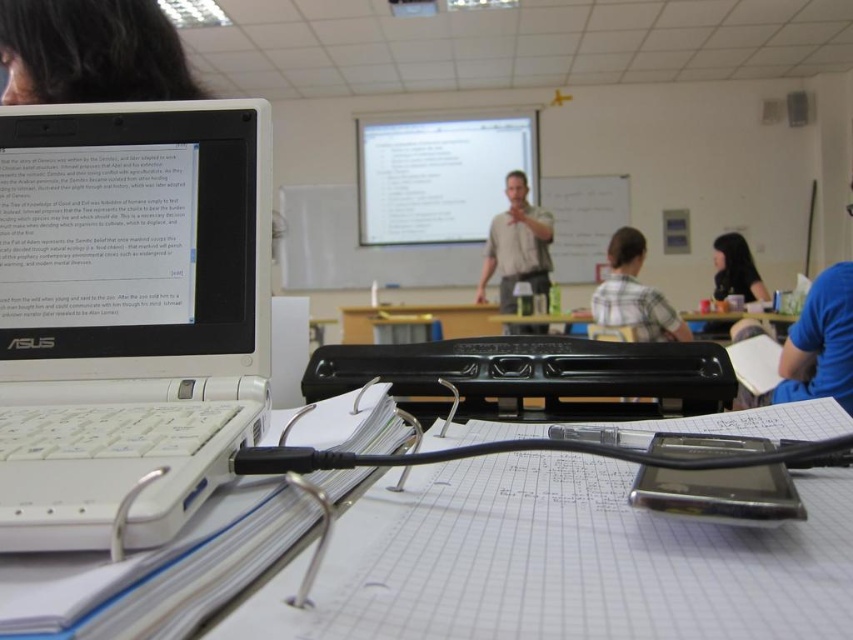
Question: Among these objects, which one is nearest to the camera?

Choices:
 (A) black hair at upper left
 (B) white plastic table at center
 (C) whiteboard at center
 (D) black hair at upper right

Answer: (B)

Question: Which point appears closest to the camera in this image?

Choices:
 (A) (585, 221)
 (B) (630, 289)
 (C) (201, 298)

Answer: (C)

Question: Can you confirm if light beige shirt at center is positioned to the right of plaid shirt at center?

Choices:
 (A) no
 (B) yes

Answer: (A)

Question: Considering the real-world distances, which object is closest to the blue fabric shirt at right?

Choices:
 (A) white plastic table at center
 (B) black hair at upper right
 (C) plaid shirt at center

Answer: (C)

Question: Is whiteboard at center smaller than plaid shirt at center?

Choices:
 (A) no
 (B) yes

Answer: (B)

Question: Does white plastic table at center have a lesser width compared to black hair at upper right?

Choices:
 (A) no
 (B) yes

Answer: (A)